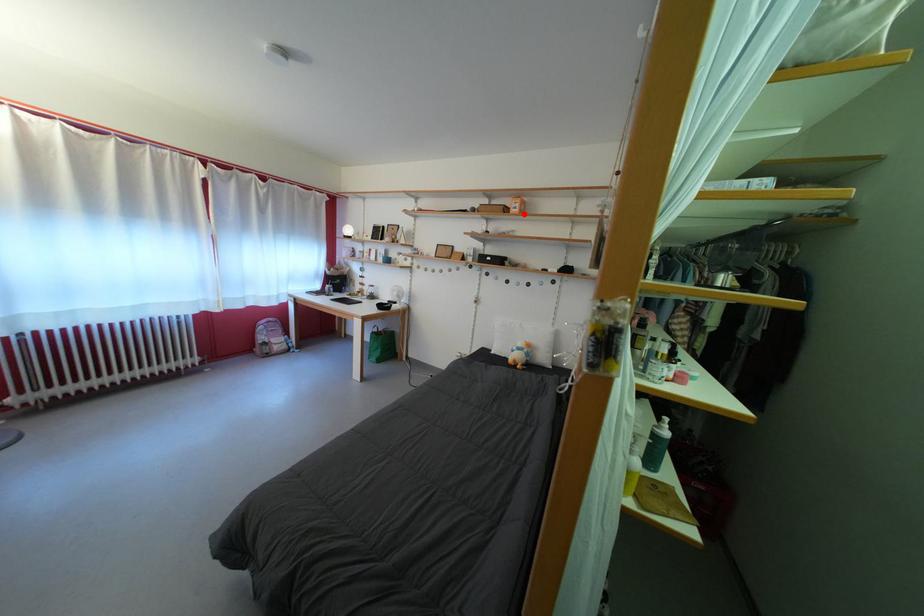
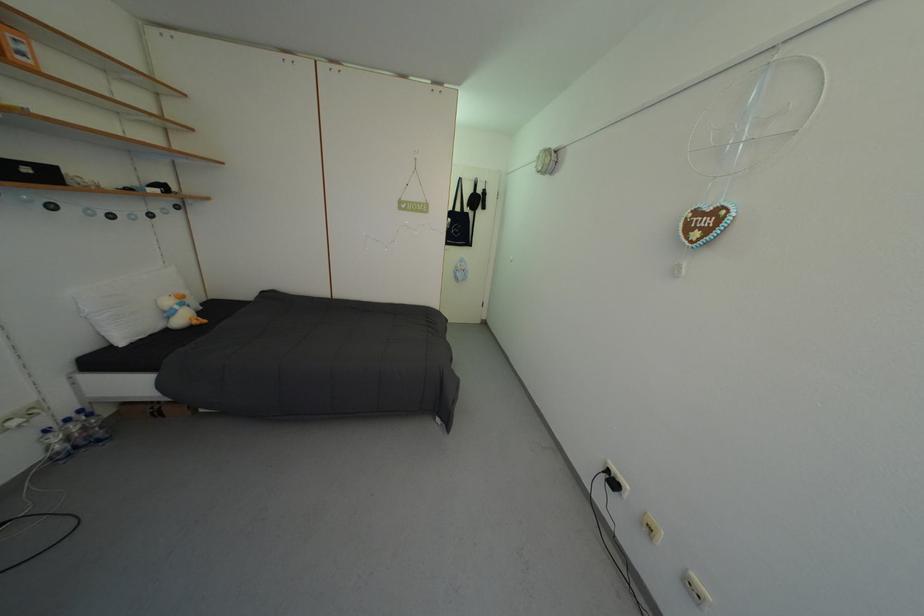
In the second image, find the point that corresponds to the highlighted location in the first image.

(30, 60)